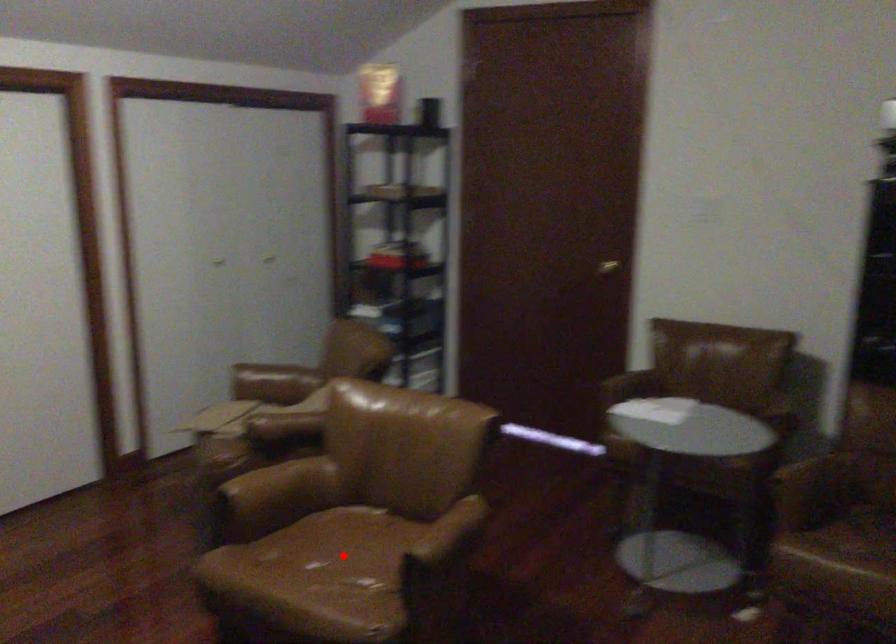
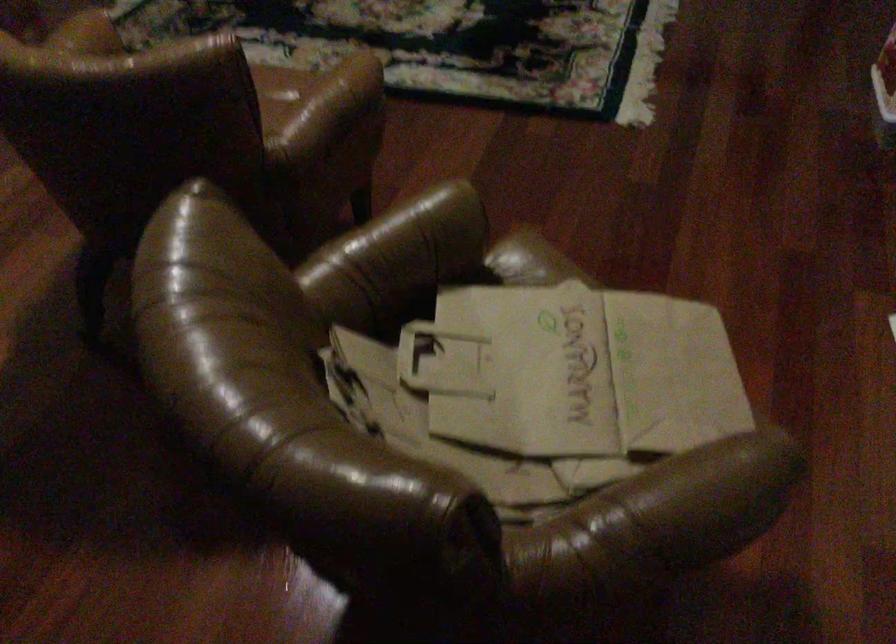
Question: I am providing you with two images of the same scene from different viewpoints. A red point is marked on the first image. Is the red point's position out of view in image 2?

Choices:
 (A) Yes
 (B) No

Answer: (A)